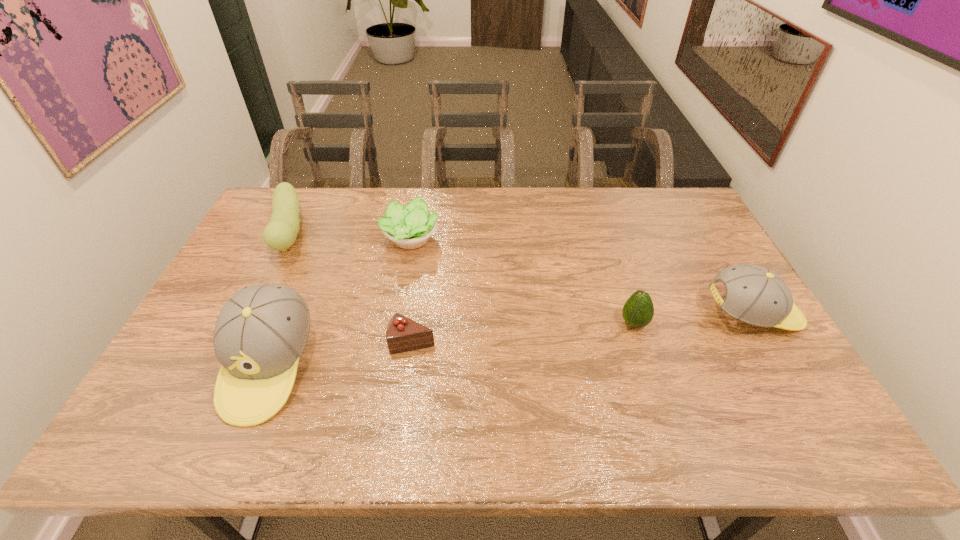
Where is `free spot located on the left of the lettuce`? free spot located on the left of the lettuce is located at coordinates (270, 240).

Image resolution: width=960 pixels, height=540 pixels. I want to click on free space located on the front of the avocado, so click(x=642, y=350).

Image resolution: width=960 pixels, height=540 pixels. What are the coordinates of `cucumber at the far edge` in the screenshot? It's located at (281, 232).

At what (x,y) coordinates should I click in order to perform the action: click on lettuce positioned at the far edge. Please return your answer as a coordinate pair (x, y). This screenshot has height=540, width=960. Looking at the image, I should click on (409, 227).

Find the location of a particular element. The height and width of the screenshot is (540, 960). object that is positioned at the near edge is located at coordinates (261, 332).

Locate an element on the screen. baseball cap at the left edge is located at coordinates (261, 332).

Locate an element on the screen. Image resolution: width=960 pixels, height=540 pixels. cucumber present at the left edge is located at coordinates (281, 232).

Find the location of a particular element. The width and height of the screenshot is (960, 540). object situated at the right edge is located at coordinates (755, 295).

Locate an element on the screen. The width and height of the screenshot is (960, 540). object at the far left corner is located at coordinates (281, 232).

This screenshot has height=540, width=960. In order to click on object that is at the near left corner in this screenshot , I will do `click(261, 332)`.